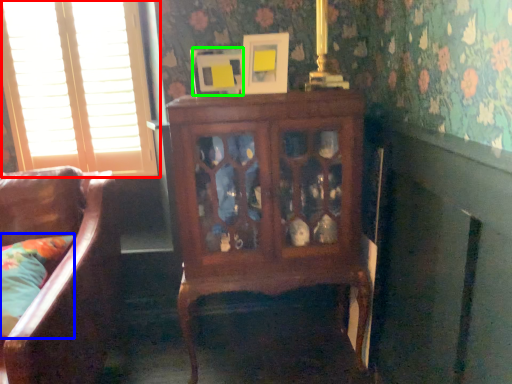
Question: Estimate the real-world distances between objects in this image. Which object is closer to window (highlighted by a red box), pillow (highlighted by a blue box) or picture frame (highlighted by a green box)?

Choices:
 (A) pillow
 (B) picture frame

Answer: (B)